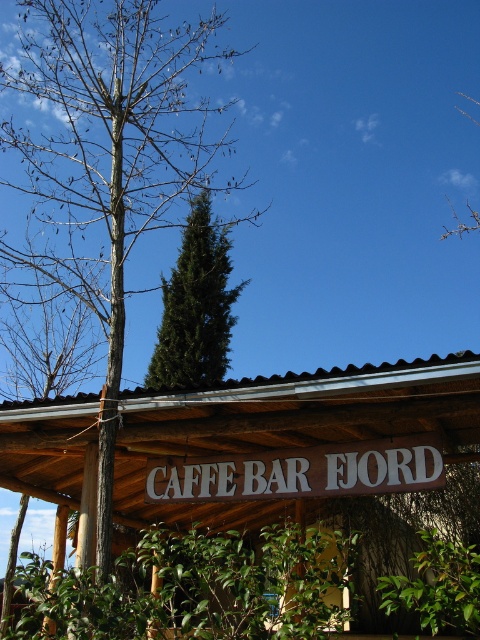
Question: Estimate the real-world distances between objects in this image. Which object is closer to the wooden signboard at center?

Choices:
 (A) white wood sign at center
 (B) bare wood tree at upper left
 (C) green coniferous tree at upper center

Answer: (A)

Question: Does white wood sign at center have a smaller size compared to green coniferous tree at upper center?

Choices:
 (A) yes
 (B) no

Answer: (A)

Question: Estimate the real-world distances between objects in this image. Which object is farther from the wooden signboard at center?

Choices:
 (A) white wood sign at center
 (B) green coniferous tree at upper center
 (C) bare wood tree at upper left

Answer: (C)

Question: Which point is farther to the camera?

Choices:
 (A) (397, 477)
 (B) (1, 70)
 (C) (157, 380)

Answer: (C)

Question: In this image, where is wooden signboard at center located relative to white wood sign at center?

Choices:
 (A) right
 (B) left

Answer: (B)

Question: Can you confirm if wooden signboard at center is wider than green coniferous tree at upper center?

Choices:
 (A) yes
 (B) no

Answer: (B)